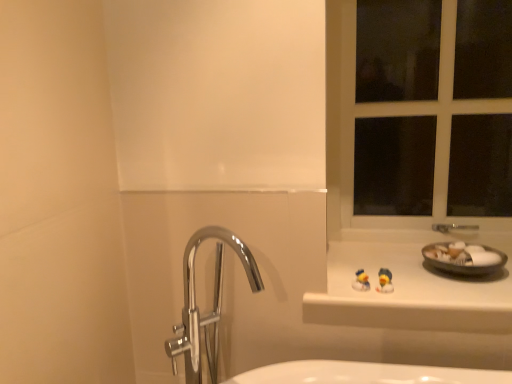
Question: Are yellow rubber duck at center, the first miniature in the right-to-left sequence, and white plastic window frame at upper right located far from each other?

Choices:
 (A) yes
 (B) no

Answer: (B)

Question: Is yellow rubber duck at center, the first miniature in the right-to-left sequence, turned away from white plastic window frame at upper right?

Choices:
 (A) yes
 (B) no

Answer: (A)

Question: Is white plastic window frame at upper right completely or partially inside yellow rubber duck at center, which appears as the second miniature when viewed from the left?

Choices:
 (A) yes
 (B) no

Answer: (B)

Question: Is yellow rubber duck at center, which appears as the second miniature when viewed from the left, positioned beyond the bounds of white plastic window frame at upper right?

Choices:
 (A) no
 (B) yes

Answer: (B)

Question: From a real-world perspective, is yellow rubber duck at center, which appears as the second miniature when viewed from the left, beneath white plastic window frame at upper right?

Choices:
 (A) yes
 (B) no

Answer: (A)

Question: Is yellow rubber duck at center, the first miniature in the right-to-left sequence, further to camera compared to white plastic window frame at upper right?

Choices:
 (A) yes
 (B) no

Answer: (B)

Question: Is the depth of white plastic window frame at upper right less than that of yellow rubber duck at center, the first miniature in the right-to-left sequence?

Choices:
 (A) no
 (B) yes

Answer: (A)

Question: Is yellow rubber duck at center, which appears as the second miniature when viewed from the left, a part of white plastic window frame at upper right?

Choices:
 (A) no
 (B) yes

Answer: (A)

Question: From a real-world perspective, is white plastic window frame at upper right over yellow rubber duck at center, which appears as the second miniature when viewed from the left?

Choices:
 (A) no
 (B) yes

Answer: (B)

Question: Would you consider white plastic window frame at upper right to be distant from yellow rubber duck at center, which appears as the second miniature when viewed from the left?

Choices:
 (A) yes
 (B) no

Answer: (B)

Question: Is white plastic window frame at upper right not inside yellow rubber duck at center, which appears as the second miniature when viewed from the left?

Choices:
 (A) no
 (B) yes

Answer: (B)

Question: Can you confirm if white plastic window frame at upper right is taller than yellow rubber duck at center, the first miniature in the right-to-left sequence?

Choices:
 (A) no
 (B) yes

Answer: (B)

Question: Would you say white glossy counter top at upper right is a long distance from yellow rubber duck at center, the first miniature in the right-to-left sequence?

Choices:
 (A) yes
 (B) no

Answer: (B)